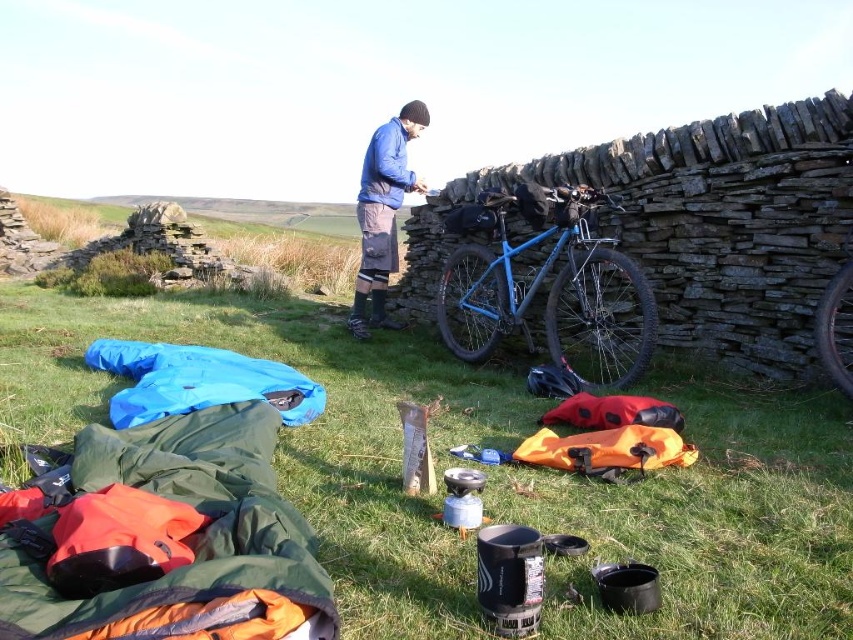
You are a camper who wants to set up a tent. You have a map showing a point at coordinates (488, 472). According to the image, what is located at that point?

The point at coordinates (488, 472) indicates green grass at center, which is suitable for setting up a tent.

You are setting up a campsite and need to place your blue fleece jacket at center. Since you want to maximize space for other items, where should you place it relative to the green grass at center?

The blue fleece jacket at center should be placed on top of or beside the green grass at center since the green grass at center is bigger and can accommodate the jacket without taking up too much space.